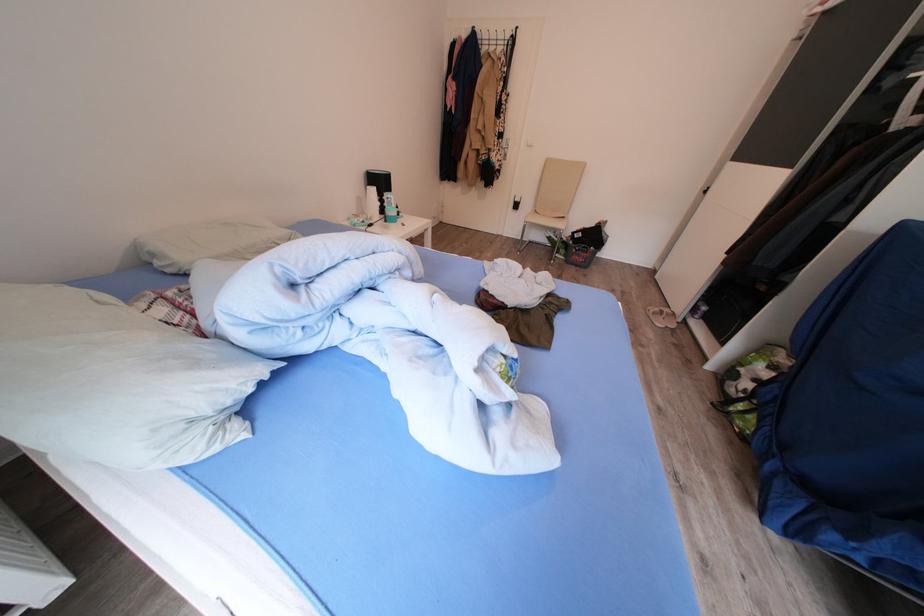
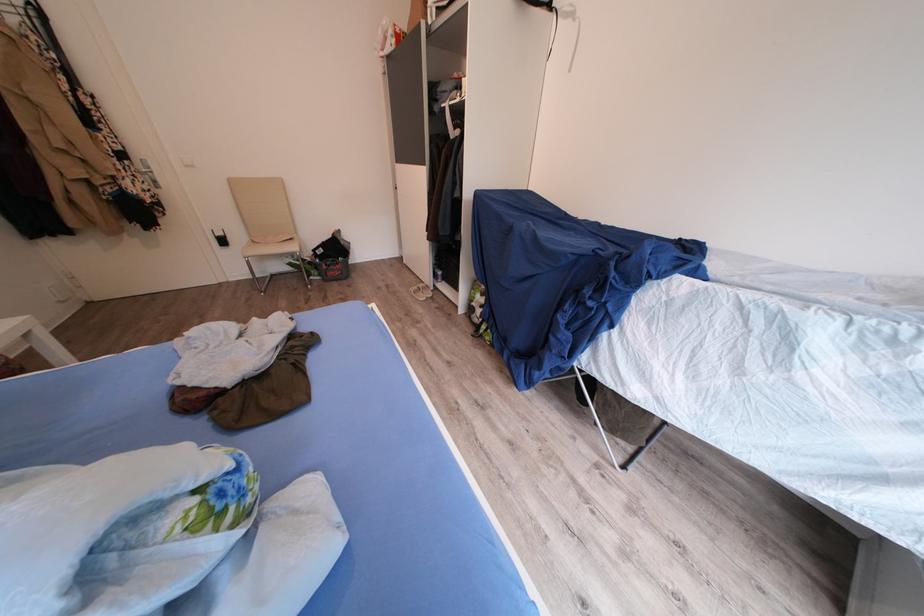
The point at (x=508, y=140) is marked in the first image. Where is the corresponding point in the second image?

(130, 161)